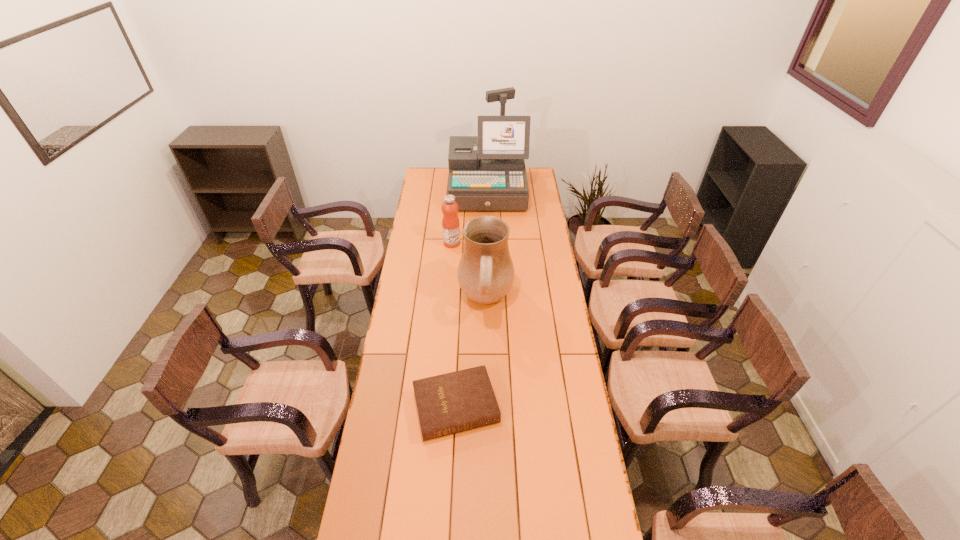
This screenshot has width=960, height=540. Identify the location of free spot at the far left corner of the desktop. (419, 187).

Identify the location of vacant area that lies between the shortest object and the third nearest object. [x=454, y=325].

Identify the location of free point between the nearest object and the third nearest object. (454, 325).

Identify the location of free area in between the nearest object and the third shortest object. (471, 354).

You are a GUI agent. You are given a task and a screenshot of the screen. Output one action in this format:
    pyautogui.click(x=<x>, y=<y>)
    Task: Click on the object that is the second closest to the cream pitcher
    The width and height of the screenshot is (960, 540).
    Given the screenshot: What is the action you would take?
    pyautogui.click(x=450, y=403)

In order to click on object that is the closest to the fruit juice in this screenshot , I will do `click(485, 273)`.

Identify the location of free region that satisfies the following two spatial constraints: 1. on the customer-facing side of the tallest object; 2. on the front label of the second shortest object. This screenshot has height=540, width=960. (489, 243).

Image resolution: width=960 pixels, height=540 pixels. What are the coordinates of `free space in the image that satisfies the following two spatial constraints: 1. on the customer-facing side of the farthest object; 2. on the front label of the fruit juice` in the screenshot? It's located at (489, 243).

Where is `vacant position in the image that satisfies the following two spatial constraints: 1. on the customer-facing side of the tallest object; 2. at the spout of the cream pitcher`? vacant position in the image that satisfies the following two spatial constraints: 1. on the customer-facing side of the tallest object; 2. at the spout of the cream pitcher is located at coordinates (490, 301).

Identify the location of vacant space that satisfies the following two spatial constraints: 1. on the front label of the second farthest object; 2. on the right side of the shortest object. The image size is (960, 540). (440, 407).